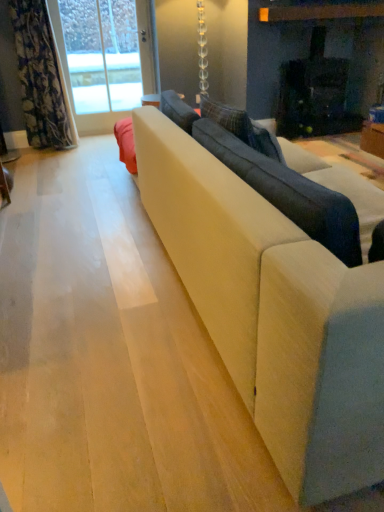
What is the approximate width of suede-like beige couch at center?

10.93 inches.

This screenshot has height=512, width=384. I want to click on clear glass door at upper left, so click(102, 54).

The image size is (384, 512). Find the location of `suede-like beige couch at center`. suede-like beige couch at center is located at coordinates (280, 294).

Find the location of a particular element. suede-like beige couch at center is located at coordinates (273, 176).

How much distance is there between suede-like beige couch at center and floral fabric curtain at left?

suede-like beige couch at center and floral fabric curtain at left are 2.84 meters apart from each other.

How different are the orientations of suede-like beige couch at center and floral fabric curtain at left in degrees?

The angular difference between suede-like beige couch at center and floral fabric curtain at left is 179 degrees.

Choose the correct answer: Is suede-like beige couch at center inside floral fabric curtain at left or outside it?

suede-like beige couch at center is not inside floral fabric curtain at left, it's outside.

Identify the location of studio couch that appears in front of the floral fabric curtain at left. This screenshot has height=512, width=384. (280, 294).

Which is closer, (347, 244) or (72, 145)?

The point (347, 244) is in front.

Consider the image. Measure the distance from suede-like beige couch at center to floral fabric curtain at left.

They are 7.92 feet apart.

Is suede-like beige couch at center not within floral fabric curtain at left?

Yes, suede-like beige couch at center is not within floral fabric curtain at left.

From the image's perspective, would you say suede-like beige couch at center is positioned over suede-like beige couch at center?

No, from the image's perspective, suede-like beige couch at center is not above suede-like beige couch at center.

Is suede-like beige couch at center facing towards suede-like beige couch at center?

Yes.

Considering the sizes of objects suede-like beige couch at center and suede-like beige couch at center in the image provided, who is shorter, suede-like beige couch at center or suede-like beige couch at center?

suede-like beige couch at center is shorter.

Does point (375, 240) lie in front of point (323, 361)?

No, (375, 240) is behind (323, 361).

Considering the positions of objects suede-like beige couch at center and clear glass door at upper left in the image provided, who is in front, suede-like beige couch at center or clear glass door at upper left?

suede-like beige couch at center is in front.

From the picture: Is suede-like beige couch at center positioned with its back to clear glass door at upper left?

suede-like beige couch at center does not have its back to clear glass door at upper left.

Do you think suede-like beige couch at center is within clear glass door at upper left, or outside of it?

suede-like beige couch at center is not inside clear glass door at upper left, it's outside.

From the image's perspective, is suede-like beige couch at center above or below clear glass door at upper left?

Based on their image positions, suede-like beige couch at center is located beneath clear glass door at upper left.

Considering the relative sizes of suede-like beige couch at center and clear glass door at upper left in the image provided, is suede-like beige couch at center wider than clear glass door at upper left?

Indeed, suede-like beige couch at center has a greater width compared to clear glass door at upper left.

Is clear glass door at upper left at the back of suede-like beige couch at center?

No.

At what (x,y) coordinates should I click in order to perform the action: click on window screen located above the suede-like beige couch at center (from the image's perspective). Please return your answer as a coordinate pair (x, y). This screenshot has width=384, height=512. Looking at the image, I should click on (102, 54).

Is suede-like beige couch at center not near clear glass door at upper left?

Indeed, suede-like beige couch at center is not near clear glass door at upper left.

How many degrees apart are the facing directions of clear glass door at upper left and suede-like beige couch at center?

The angle between the facing direction of clear glass door at upper left and the facing direction of suede-like beige couch at center is 90.2 degrees.

Is clear glass door at upper left spatially inside suede-like beige couch at center, or outside of it?

clear glass door at upper left is not enclosed by suede-like beige couch at center.

Who is shorter, clear glass door at upper left or suede-like beige couch at center?

Standing shorter between the two is suede-like beige couch at center.

Is clear glass door at upper left wider or thinner than suede-like beige couch at center?

Considering their sizes, clear glass door at upper left looks slimmer than suede-like beige couch at center.

From the picture: Is floral fabric curtain at left positioned with its back to clear glass door at upper left?

No.

Does point (13, 4) come farther from viewer compared to point (115, 58)?

No, (13, 4) is closer to viewer.

Considering the sizes of objects floral fabric curtain at left and clear glass door at upper left in the image provided, who is smaller, floral fabric curtain at left or clear glass door at upper left?

Smaller between the two is clear glass door at upper left.

Where is `studio couch lying below the floral fabric curtain at left (from the image's perspective)`? studio couch lying below the floral fabric curtain at left (from the image's perspective) is located at coordinates (280, 294).

Find the location of a particular element. couch directly beneath the floral fabric curtain at left (from a real-world perspective) is located at coordinates (273, 176).

Based on their spatial positions, is floral fabric curtain at left or clear glass door at upper left further from suede-like beige couch at center?

The object further to suede-like beige couch at center is clear glass door at upper left.

Based on their spatial positions, is floral fabric curtain at left or suede-like beige couch at center closer to suede-like beige couch at center?

Based on the image, suede-like beige couch at center appears to be nearer to suede-like beige couch at center.

From the image, which object appears to be nearer to suede-like beige couch at center, floral fabric curtain at left or suede-like beige couch at center?

Based on the image, suede-like beige couch at center appears to be nearer to suede-like beige couch at center.

Considering their positions, is suede-like beige couch at center positioned closer to suede-like beige couch at center than floral fabric curtain at left?

The object closer to suede-like beige couch at center is suede-like beige couch at center.

Estimate the real-world distances between objects in this image. Which object is closer to clear glass door at upper left, suede-like beige couch at center or suede-like beige couch at center?

suede-like beige couch at center lies closer to clear glass door at upper left than the other object.

Estimate the real-world distances between objects in this image. Which object is closer to clear glass door at upper left, floral fabric curtain at left or suede-like beige couch at center?

floral fabric curtain at left.

Considering their positions, is clear glass door at upper left positioned further to floral fabric curtain at left than suede-like beige couch at center?

suede-like beige couch at center lies further to floral fabric curtain at left than the other object.

From the image, which object appears to be farther from floral fabric curtain at left, suede-like beige couch at center or suede-like beige couch at center?

suede-like beige couch at center.

The image size is (384, 512). What are the coordinates of `couch located between suede-like beige couch at center and clear glass door at upper left in the depth direction` in the screenshot? It's located at (273, 176).

Locate an element on the screen. The width and height of the screenshot is (384, 512). curtain located between suede-like beige couch at center and clear glass door at upper left in the depth direction is located at coordinates (41, 78).

At what (x,y) coordinates should I click in order to perform the action: click on couch positioned between suede-like beige couch at center and floral fabric curtain at left from near to far. Please return your answer as a coordinate pair (x, y). This screenshot has height=512, width=384. Looking at the image, I should click on (x=273, y=176).

Find the location of `curtain positioned between suede-like beige couch at center and clear glass door at upper left from near to far`. curtain positioned between suede-like beige couch at center and clear glass door at upper left from near to far is located at coordinates (41, 78).